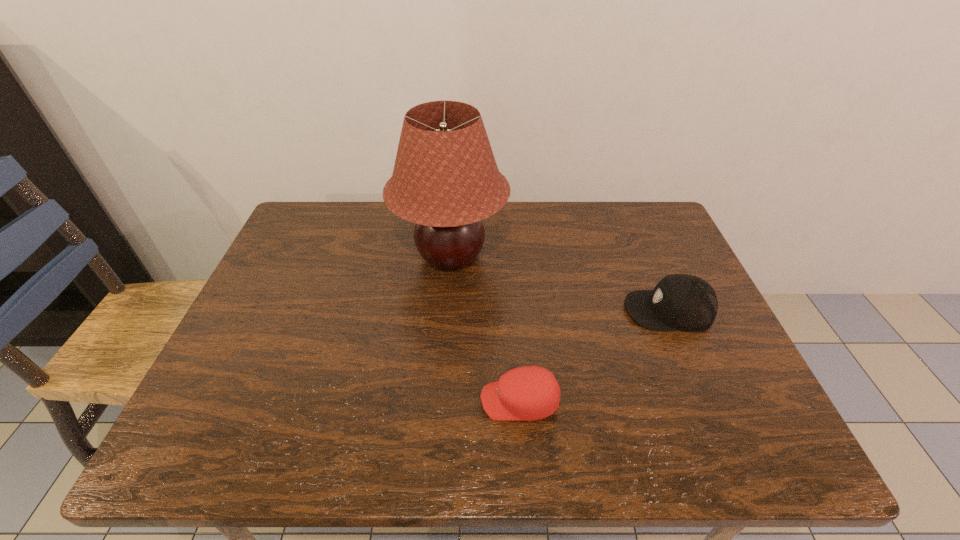
In the image, there is a desktop. Find the location of `vacant space at the near left corner`. vacant space at the near left corner is located at coordinates (241, 451).

In order to click on vacant space at the far right corner in this screenshot , I will do `click(668, 233)`.

Identify the location of unoccupied position between the nearer cap and the taller cap. The height and width of the screenshot is (540, 960). (594, 355).

This screenshot has width=960, height=540. In order to click on free space between the shortest object and the tallest object in this screenshot , I will do `click(485, 329)`.

At what (x,y) coordinates should I click in order to perform the action: click on unoccupied position between the taller cap and the nearest object. Please return your answer as a coordinate pair (x, y). Looking at the image, I should click on (594, 355).

I want to click on vacant space that is in between the second shortest object and the tallest object, so click(560, 283).

This screenshot has width=960, height=540. Find the location of `vacant space that is in between the shorter cap and the rightmost object`. vacant space that is in between the shorter cap and the rightmost object is located at coordinates (594, 355).

Locate an element on the screen. vacant area between the lampshade and the farther cap is located at coordinates (560, 283).

Image resolution: width=960 pixels, height=540 pixels. What are the coordinates of `vacant area that lies between the taller cap and the shorter cap` in the screenshot? It's located at (594, 355).

Identify the location of free area in between the tallest object and the shorter cap. This screenshot has width=960, height=540. (485, 329).